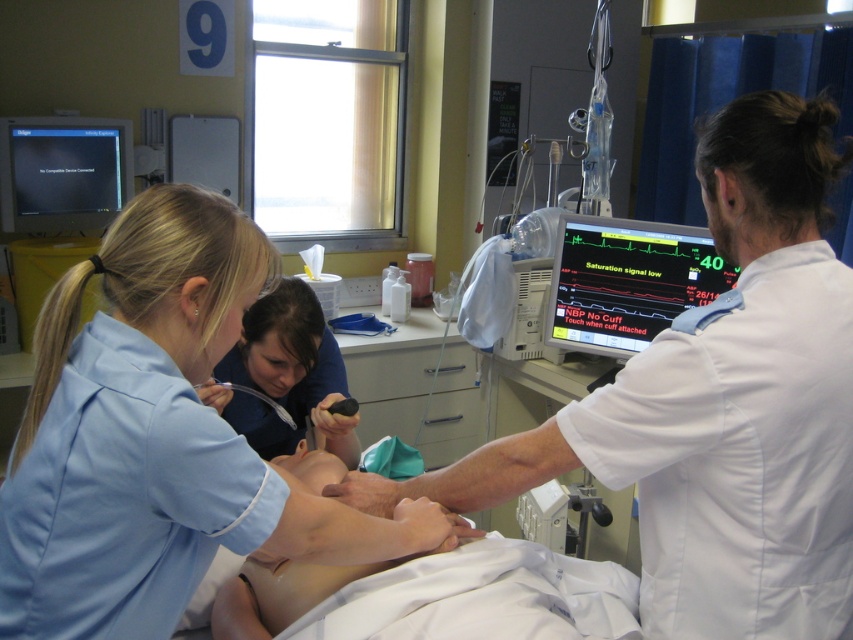
Question: From the image, what is the correct spatial relationship of blue uniform at center in relation to matte black monitor at center right?

Choices:
 (A) above
 (B) below

Answer: (B)

Question: Which point is closer to the camera taking this photo?

Choices:
 (A) (680, 264)
 (B) (67, 189)
 (C) (227, 208)

Answer: (C)

Question: Among these objects, which one is farthest from the camera?

Choices:
 (A) blue uniform at center
 (B) matte black monitor at upper left

Answer: (B)

Question: Is the position of blue uniform at center less distant than that of matte black monitor at center right?

Choices:
 (A) no
 (B) yes

Answer: (B)

Question: Can you confirm if matte black monitor at center right is thinner than matte black monitor at upper left?

Choices:
 (A) no
 (B) yes

Answer: (A)

Question: Estimate the real-world distances between objects in this image. Which object is closer to the smooth skin child at center?

Choices:
 (A) matte black monitor at upper left
 (B) blue uniform at center
 (C) matte black monitor at center right

Answer: (B)